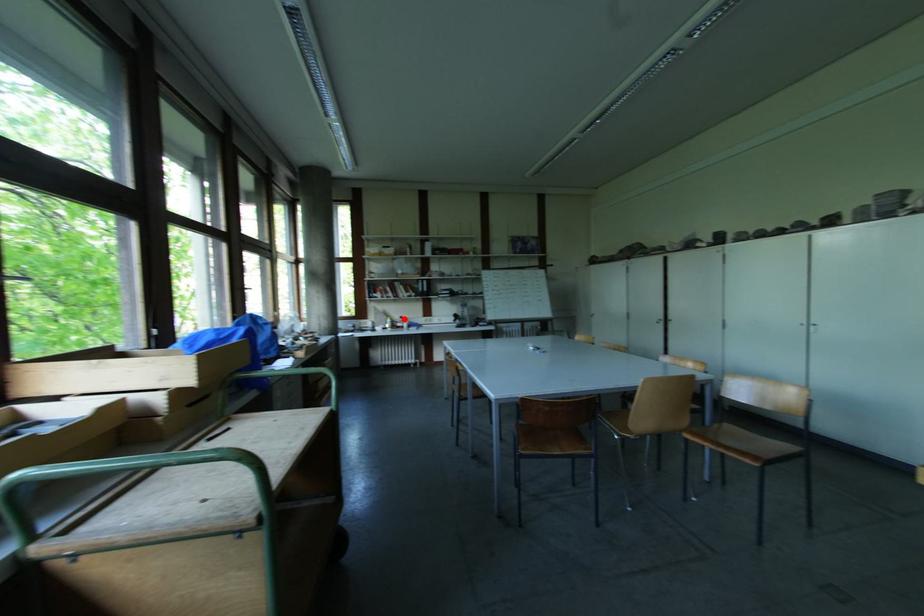
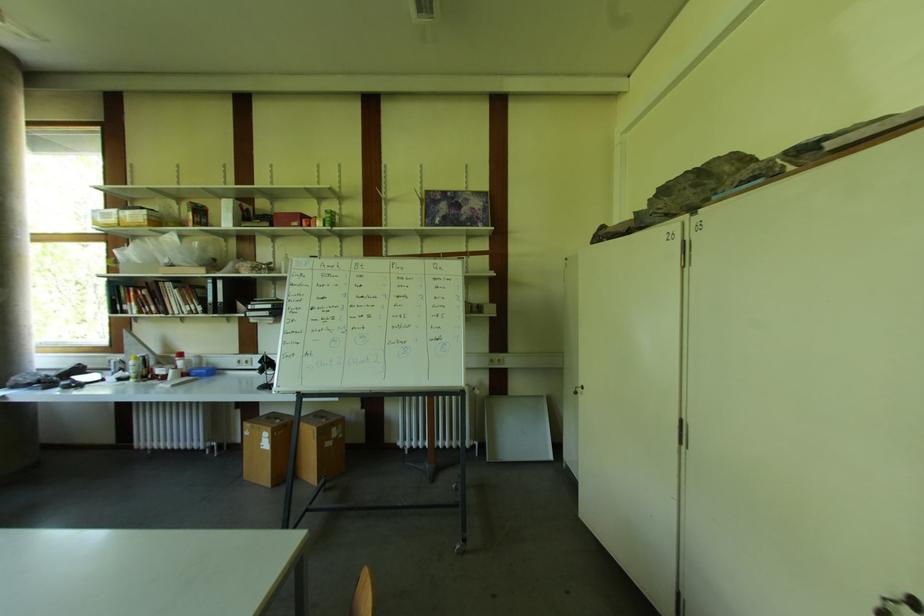
Find the pixel in the second image that matches the highlighted location in the first image.

(184, 357)